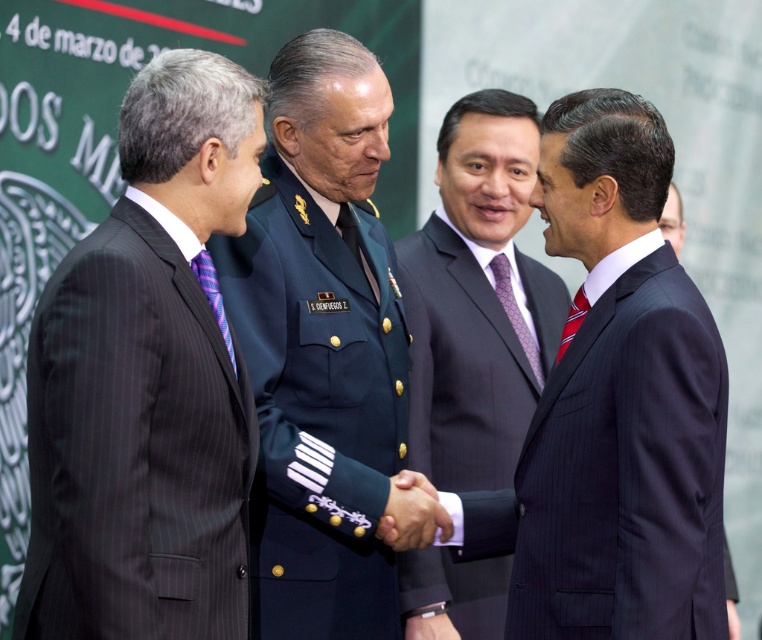
From the picture: You are attending the event and need to identify the man wearing the dark blue suit at center and the red silk tie at center. Based on their positions, which one is standing to the left side?

The dark blue suit at center is to the left of the red silk tie at center, so the man wearing the dark blue suit at center is standing to the left side.

You are standing at the center of the room and want to reach the point marked at coordinates (456, 387). There are two men shaking hands in front of you. Can you walk straight to the point without going around them?

The point marked at coordinates (456, 387) is 20.70 feet away from the viewer. Since the two men shaking hands are in the foreground, they are closer to you than the point. Therefore, walking straight towards the point would require passing behind the men or going around them as they are blocking the direct path.